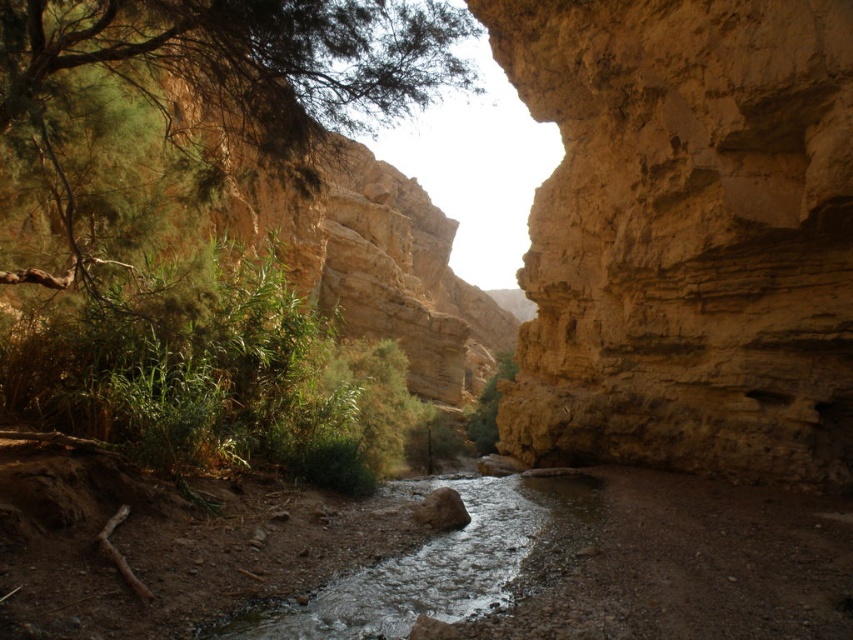
Question: Is green leafy tree at upper left behind green leafy tree at center?

Choices:
 (A) yes
 (B) no

Answer: (B)

Question: In this image, where is matte yellow rock at center located relative to green leafy tree at center?

Choices:
 (A) left
 (B) right

Answer: (B)

Question: Can you confirm if green leafy tree at upper left is wider than green leafy tree at center?

Choices:
 (A) no
 (B) yes

Answer: (B)

Question: Which of the following is the closest to the observer?

Choices:
 (A) green leafy tree at upper left
 (B) matte yellow rock at center

Answer: (A)

Question: Which point appears closest to the camera in this image?

Choices:
 (A) (804, 195)
 (B) (488, 417)

Answer: (A)

Question: Among these objects, which one is farthest from the camera?

Choices:
 (A) matte yellow rock at center
 (B) green leafy tree at center
 (C) green leafy tree at upper left

Answer: (B)